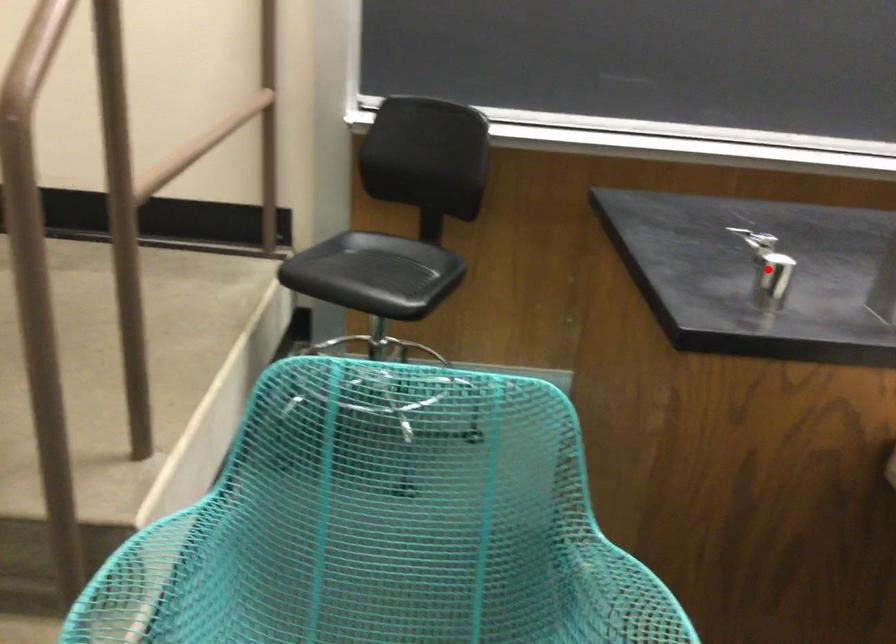
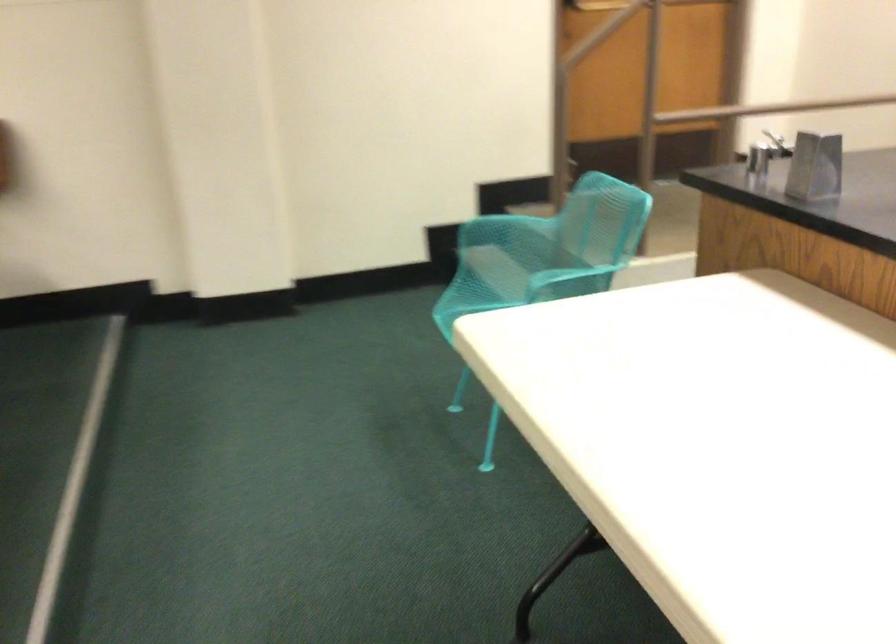
Question: I am providing you with two images of the same scene from different viewpoints. A red point is marked on the first image. Is the red point's position out of view in image 2?

Choices:
 (A) Yes
 (B) No

Answer: (A)